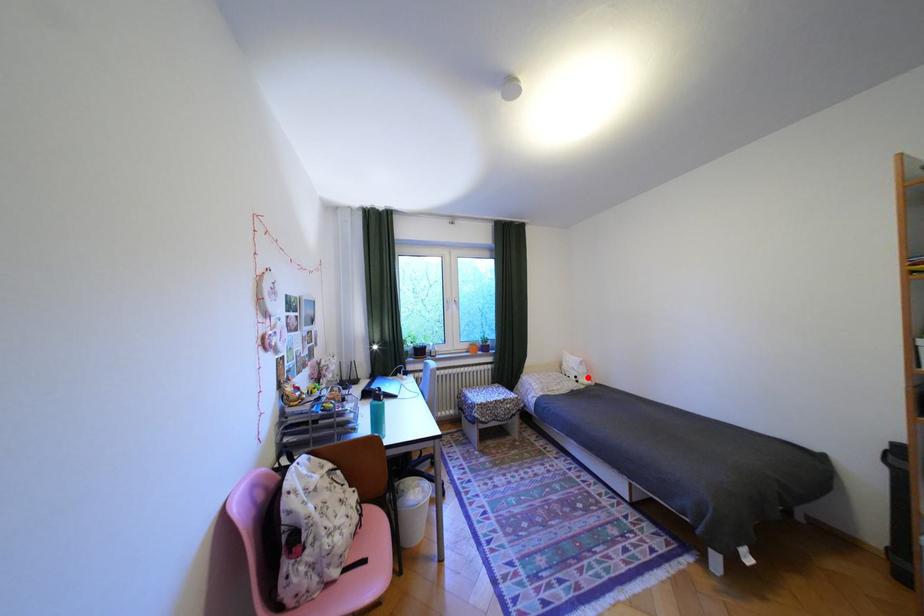
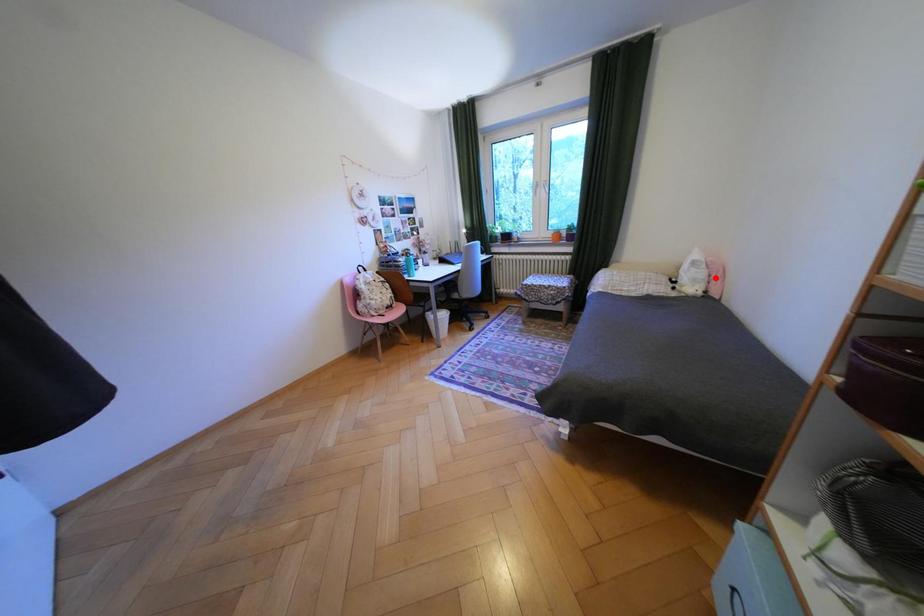
I am providing you with two images of the same scene from different viewpoints. A red point is marked on the first image and another point is marked on the second image. Is the marked point in image1 the same physical position as the marked point in image2?

No